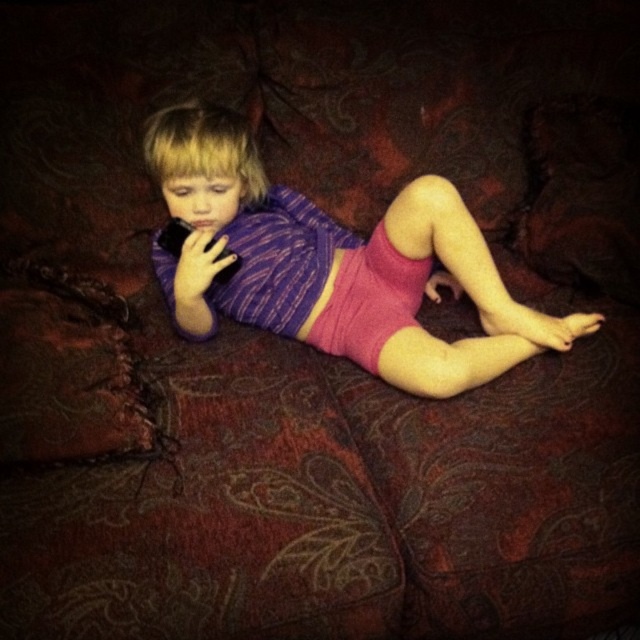
Question: Which point appears farthest from the camera in this image?

Choices:
 (A) (381, 275)
 (B) (424, 356)

Answer: (A)

Question: Does pink knitted shorts at center have a greater width compared to pink fabric shorts at center?

Choices:
 (A) yes
 (B) no

Answer: (A)

Question: Can you confirm if pink knitted shorts at center is positioned to the right of pink fabric shorts at center?

Choices:
 (A) yes
 (B) no

Answer: (B)

Question: Which object appears closest to the camera in this image?

Choices:
 (A) pink fabric shorts at center
 (B) pink knitted shorts at center

Answer: (B)

Question: Is pink knitted shorts at center wider than pink fabric shorts at center?

Choices:
 (A) no
 (B) yes

Answer: (B)

Question: Which point is farther from the camera taking this photo?

Choices:
 (A) (422, 266)
 (B) (488, 321)

Answer: (B)